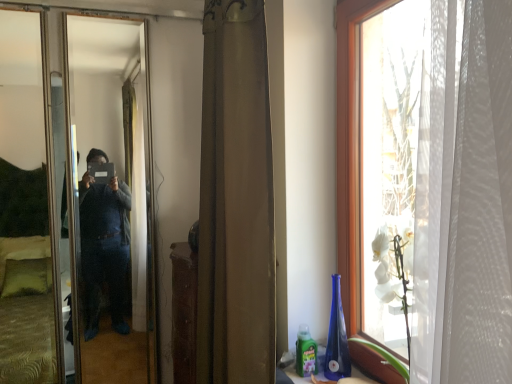
Identify the location of brown fabric curtain at center. This screenshot has height=384, width=512. (234, 201).

What do you see at coordinates (234, 201) in the screenshot? I see `brown fabric curtain at center` at bounding box center [234, 201].

This screenshot has height=384, width=512. What do you see at coordinates (110, 196) in the screenshot?
I see `metallic reflective mirror at left` at bounding box center [110, 196].

At what (x,y) coordinates should I click in order to perform the action: click on metallic reflective mirror at left. Please return your answer as a coordinate pair (x, y). Looking at the image, I should click on (110, 196).

Find the location of `brown fabric curtain at center`. brown fabric curtain at center is located at coordinates (234, 201).

Considering the positions of objects metallic reflective mirror at left and brown fabric curtain at center in the image provided, who is more to the left, metallic reflective mirror at left or brown fabric curtain at center?

Positioned to the left is metallic reflective mirror at left.

Does metallic reflective mirror at left lie in front of brown fabric curtain at center?

That is False.

Is point (111, 52) closer or farther from the camera than point (218, 202)?

Point (111, 52) is positioned farther from the camera compared to point (218, 202).

From the image's perspective, which is below, metallic reflective mirror at left or brown fabric curtain at center?

metallic reflective mirror at left.

From a real-world perspective, is metallic reflective mirror at left positioned over brown fabric curtain at center based on gravity?

No, from a real-world perspective, metallic reflective mirror at left is not on top of brown fabric curtain at center.

Considering the relative sizes of metallic reflective mirror at left and brown fabric curtain at center in the image provided, is metallic reflective mirror at left wider than brown fabric curtain at center?

In fact, metallic reflective mirror at left might be narrower than brown fabric curtain at center.

Between metallic reflective mirror at left and brown fabric curtain at center, which one has more height?

metallic reflective mirror at left.

Can you confirm if metallic reflective mirror at left is smaller than brown fabric curtain at center?

Yes.

Can brown fabric curtain at center be found inside metallic reflective mirror at left?

No, brown fabric curtain at center is located outside of metallic reflective mirror at left.

Is metallic reflective mirror at left next to brown fabric curtain at center and touching it?

metallic reflective mirror at left and brown fabric curtain at center are not in contact.

Is metallic reflective mirror at left oriented away from brown fabric curtain at center?

metallic reflective mirror at left is not turned away from brown fabric curtain at center.

Find the location of `mirror below the brown fabric curtain at center (from a real-world perspective)`. mirror below the brown fabric curtain at center (from a real-world perspective) is located at coordinates (110, 196).

Considering the relative positions of brown fabric curtain at center and metallic reflective mirror at left in the image provided, is brown fabric curtain at center to the right of metallic reflective mirror at left from the viewer's perspective?

Yes, brown fabric curtain at center is to the right of metallic reflective mirror at left.

Is the depth of brown fabric curtain at center greater than that of metallic reflective mirror at left?

No, brown fabric curtain at center is closer to the camera.

Which is farther, (x=243, y=293) or (x=94, y=23)?

The point (x=94, y=23) is farther.

From the image's perspective, would you say brown fabric curtain at center is shown under metallic reflective mirror at left?

Incorrect, from the image's perspective, brown fabric curtain at center is higher than metallic reflective mirror at left.

From a real-world perspective, is brown fabric curtain at center physically located above or below metallic reflective mirror at left?

brown fabric curtain at center is above metallic reflective mirror at left.

Considering the sizes of brown fabric curtain at center and metallic reflective mirror at left in the image, is brown fabric curtain at center wider or thinner than metallic reflective mirror at left?

Considering their sizes, brown fabric curtain at center looks broader than metallic reflective mirror at left.

Considering the sizes of objects brown fabric curtain at center and metallic reflective mirror at left in the image provided, who is taller, brown fabric curtain at center or metallic reflective mirror at left?

With more height is metallic reflective mirror at left.

Can you confirm if brown fabric curtain at center is bigger than metallic reflective mirror at left?

Indeed, brown fabric curtain at center has a larger size compared to metallic reflective mirror at left.

Is brown fabric curtain at center spatially inside metallic reflective mirror at left, or outside of it?

The correct answer is: outside.

Does brown fabric curtain at center touch metallic reflective mirror at left?

No, brown fabric curtain at center is not beside metallic reflective mirror at left.

Is brown fabric curtain at center oriented towards metallic reflective mirror at left?

No, brown fabric curtain at center does not turn towards metallic reflective mirror at left.

How different are the orientations of brown fabric curtain at center and metallic reflective mirror at left in degrees?

brown fabric curtain at center and metallic reflective mirror at left are facing 91.4 degrees away from each other.

From the picture: How far apart are brown fabric curtain at center and metallic reflective mirror at left?

brown fabric curtain at center is 32.66 inches away from metallic reflective mirror at left.

Where is `curtain above the metallic reflective mirror at left (from a real-world perspective)`? This screenshot has width=512, height=384. curtain above the metallic reflective mirror at left (from a real-world perspective) is located at coordinates (234, 201).

Locate an element on the screen. This screenshot has width=512, height=384. mirror behind the brown fabric curtain at center is located at coordinates (110, 196).

Where is `curtain that is above the metallic reflective mirror at left (from the image's perspective)`? The image size is (512, 384). curtain that is above the metallic reflective mirror at left (from the image's perspective) is located at coordinates (234, 201).